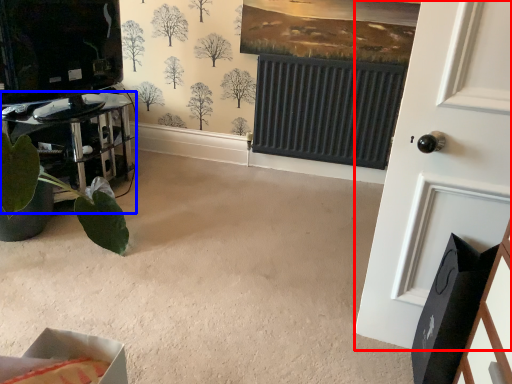
Question: Among these objects, which one is farthest to the camera, door (highlighted by a red box) or furniture (highlighted by a blue box)?

Choices:
 (A) door
 (B) furniture

Answer: (B)